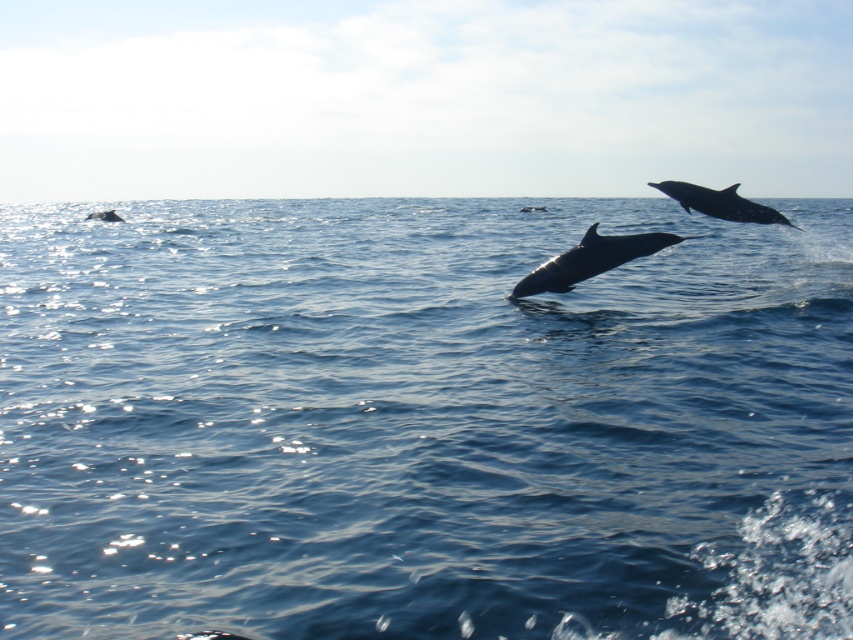
Between silvery skin dolphin at center and smooth gray dolphin at upper right, which one is positioned lower?

silvery skin dolphin at center is below.

Does silvery skin dolphin at center have a greater height compared to smooth gray dolphin at upper right?

Correct, silvery skin dolphin at center is much taller as smooth gray dolphin at upper right.

Is point (595, 252) farther from camera compared to point (662, 189)?

No.

The image size is (853, 640). What are the coordinates of `silvery skin dolphin at center` in the screenshot? It's located at (590, 259).

Who is lower down, blue water at center or silvery skin dolphin at center?

silvery skin dolphin at center

Is blue water at center in front of silvery skin dolphin at center?

That is True.

Between point (601, 380) and point (639, 241), which one is positioned in front?

Point (601, 380)

Where is `blue water at center`? blue water at center is located at coordinates (422, 422).

Is blue water at center shorter than gray matte whale at lower left?

No, blue water at center is not shorter than gray matte whale at lower left.

Is point (514, 353) more distant than point (117, 216)?

No.

Where is `blue water at center`? blue water at center is located at coordinates (422, 422).